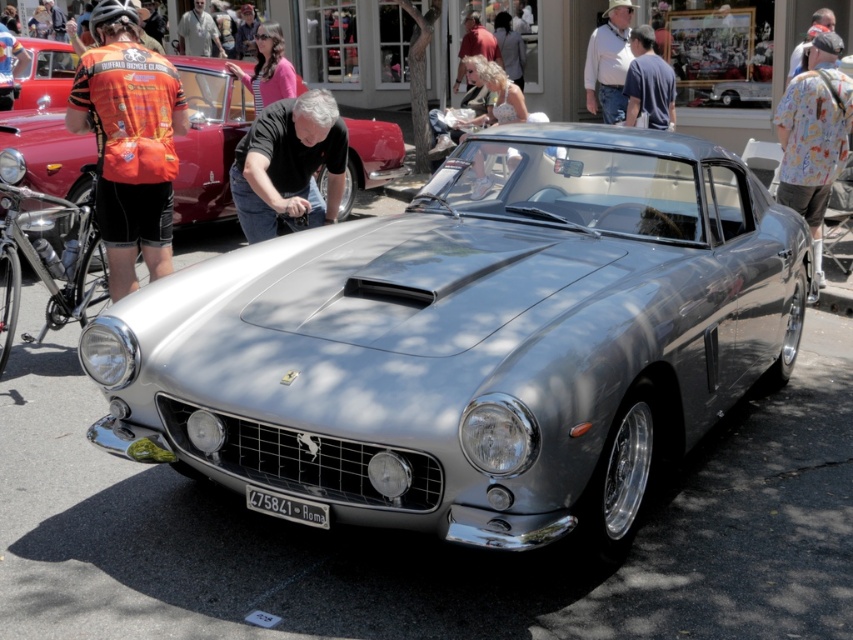
You are standing in front of the classic silver sports car at the car show. There are two points marked on the car, one at coordinate point (602, 106) and the other at point (631, 88). Which point is closer to you?

Point (602, 106) is further to the camera than point (631, 88), so the point closer to you is point (631, 88).

You are a photographer at the car show and want to capture both the white cotton shirt at upper center and the blue cotton shirt at upper center in the same frame. The camera has a maximum focus range of 30 inches. Can you fit both shirts into the frame without moving the camera?

The white cotton shirt at upper center and blue cotton shirt at upper center are 32.00 inches apart. Since the distance between them exceeds the camera maximum focus range of 30 inches, you cannot fit both shirts into the frame without moving the camera.

You are standing in front of the classic silver sports car at the car show. You notice two points marked on the car. The first point is at coordinate point (210,211) and the second is at point (819,248). Which point is closer to your eyes?

Point (210,211) is closer to your eyes because it is further to the camera than point (819,248).